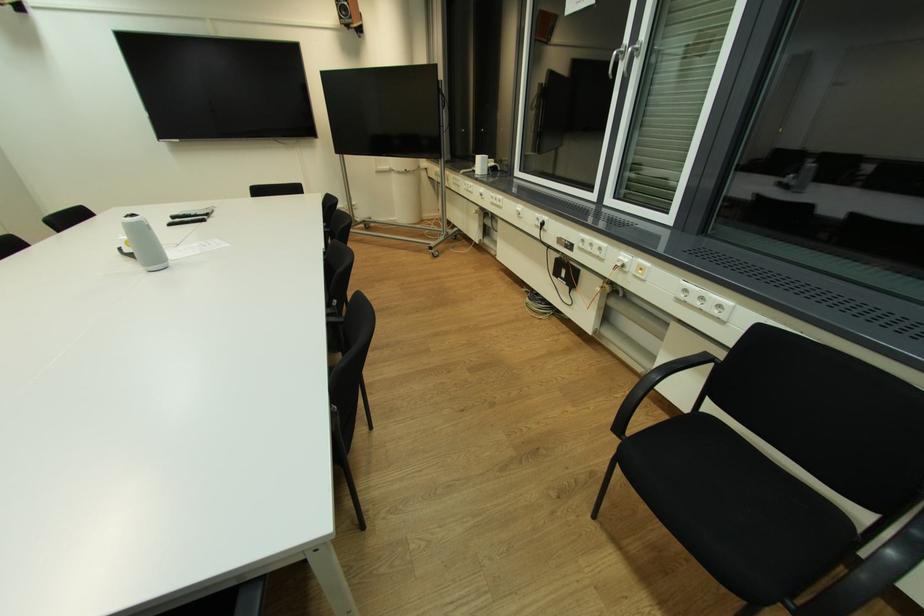
I want to click on silver window handle, so click(614, 61).